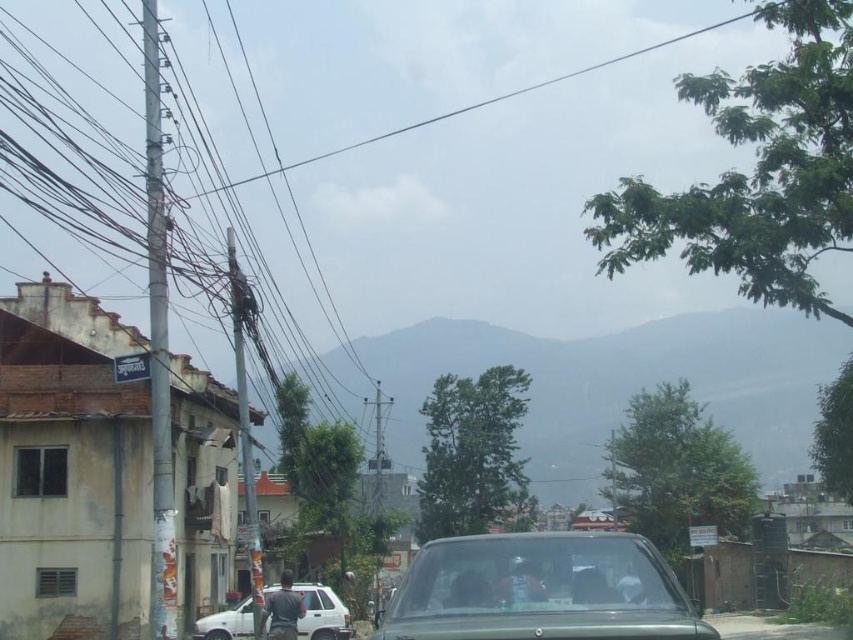
Question: Which point is farther to the camera?

Choices:
 (A) white matte suv at center
 (B) green matte car at center

Answer: (A)

Question: Among these points, which one is farthest from the camera?

Choices:
 (A) (305, 608)
 (B) (572, 616)

Answer: (A)

Question: Is green matte car at center above white matte suv at center?

Choices:
 (A) yes
 (B) no

Answer: (A)

Question: In this image, where is green matte car at center located relative to white matte suv at center?

Choices:
 (A) left
 (B) right

Answer: (B)

Question: Which point is farther to the camera?

Choices:
 (A) green matte car at center
 (B) white matte suv at center

Answer: (B)

Question: From the image, what is the correct spatial relationship of green matte car at center in relation to white matte suv at center?

Choices:
 (A) right
 (B) left

Answer: (A)